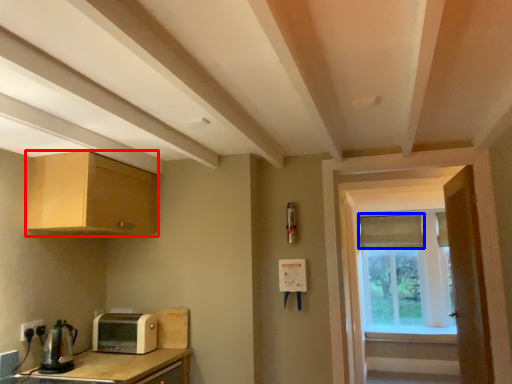
Question: Which object is further to the camera taking this photo, cabinetry (highlighted by a red box) or curtain (highlighted by a blue box)?

Choices:
 (A) cabinetry
 (B) curtain

Answer: (B)